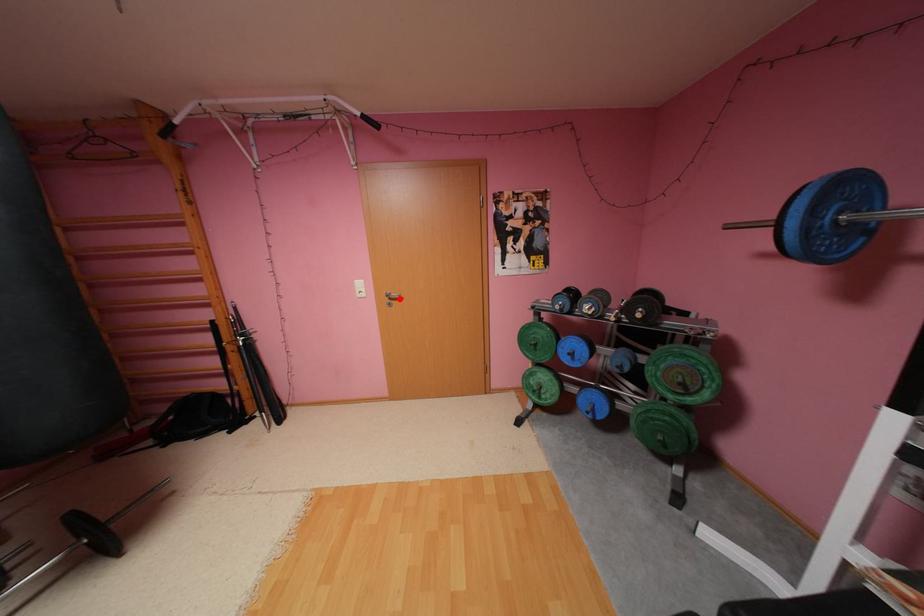
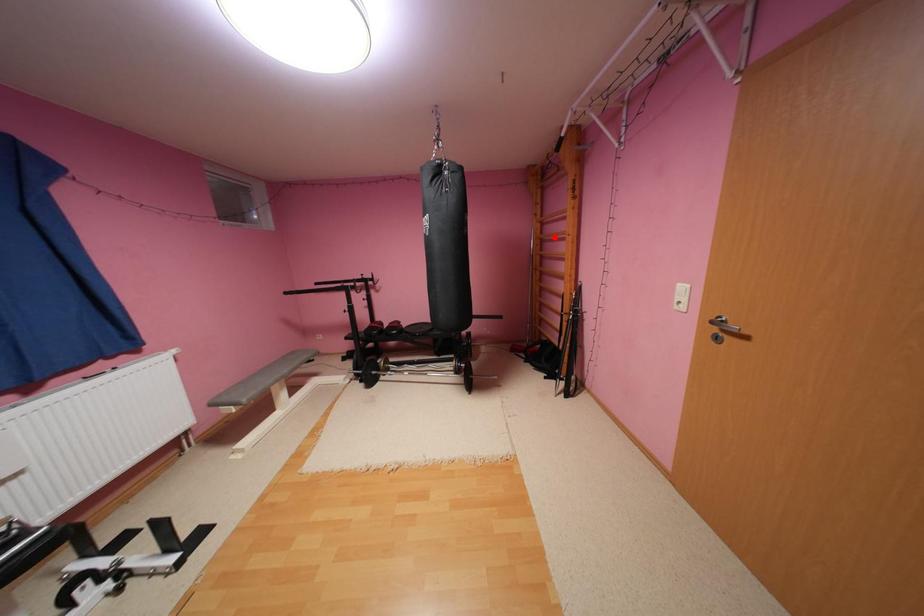
In the scene shown: I am providing you with two images of the same scene from different viewpoints. A red point is marked on the first image and another point is marked on the second image. Is the red point in image1 aligned with the point shown in image2?

No